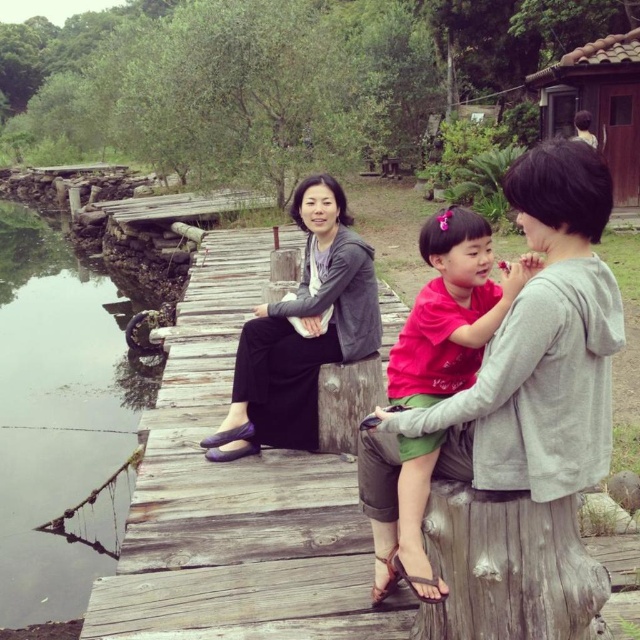
Question: Which is nearer to the matte pink shirt at center?

Choices:
 (A) matte gray hoodie at center
 (B) transparent water at left

Answer: (A)

Question: Does matte gray hoodie at center have a smaller size compared to matte pink shirt at center?

Choices:
 (A) yes
 (B) no

Answer: (B)

Question: Which of the following is the closest to the observer?

Choices:
 (A) matte pink shirt at center
 (B) transparent water at left
 (C) matte gray hoodie at center

Answer: (C)

Question: Which object is farther from the camera taking this photo?

Choices:
 (A) matte pink shirt at center
 (B) matte gray sweater at center
 (C) matte gray hoodie at center

Answer: (B)

Question: Does transparent water at left have a greater width compared to matte gray sweater at center?

Choices:
 (A) no
 (B) yes

Answer: (B)

Question: Is matte gray sweater at center above matte pink shirt at center?

Choices:
 (A) no
 (B) yes

Answer: (B)